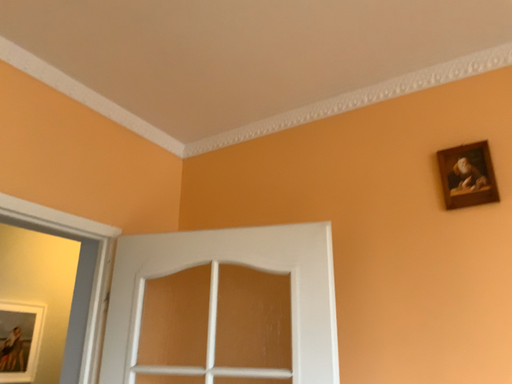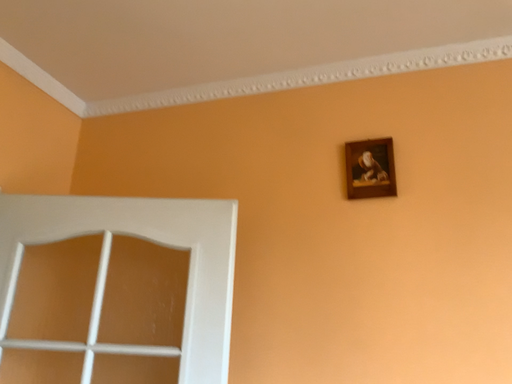
Question: Which way did the camera rotate in the video?

Choices:
 (A) rotated right
 (B) rotated left

Answer: (A)